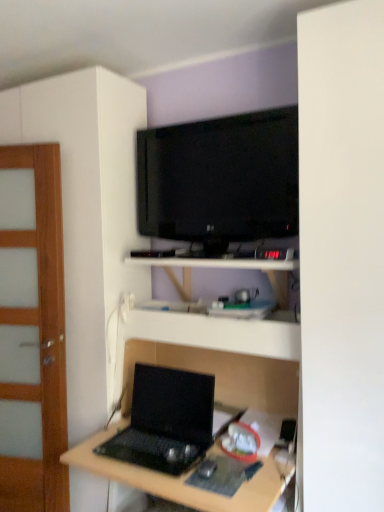
Question: Is matte black laptop at center not near wooden door at left?

Choices:
 (A) yes
 (B) no

Answer: (B)

Question: Does matte black laptop at center have a greater height compared to wooden door at left?

Choices:
 (A) no
 (B) yes

Answer: (A)

Question: Considering the relative sizes of matte black laptop at center and wooden door at left in the image provided, is matte black laptop at center bigger than wooden door at left?

Choices:
 (A) yes
 (B) no

Answer: (A)

Question: Is the position of matte black laptop at center less distant than that of wooden door at left?

Choices:
 (A) no
 (B) yes

Answer: (B)

Question: Does matte black laptop at center have a lesser height compared to wooden door at left?

Choices:
 (A) no
 (B) yes

Answer: (B)

Question: Is black plastic mouse at lower center bigger or smaller than matte black laptop at center?

Choices:
 (A) small
 (B) big

Answer: (A)

Question: From the image's perspective, relative to matte black laptop at center, is black plastic mouse at lower center above or below?

Choices:
 (A) below
 (B) above

Answer: (B)

Question: Does point (205, 474) appear closer or farther from the camera than point (274, 356)?

Choices:
 (A) closer
 (B) farther

Answer: (A)

Question: From a real-world perspective, is black plastic mouse at lower center above or below matte black laptop at center?

Choices:
 (A) above
 (B) below

Answer: (A)

Question: From the image's perspective, relative to white matte shelf at center, is wooden door at left above or below?

Choices:
 (A) below
 (B) above

Answer: (A)

Question: In terms of height, does wooden door at left look taller or shorter compared to white matte shelf at center?

Choices:
 (A) tall
 (B) short

Answer: (A)

Question: Is wooden door at left inside or outside of white matte shelf at center?

Choices:
 (A) inside
 (B) outside

Answer: (B)

Question: Is wooden door at left bigger or smaller than white matte shelf at center?

Choices:
 (A) big
 (B) small

Answer: (A)

Question: Is black matte laptop at lower center bigger or smaller than wooden door at left?

Choices:
 (A) big
 (B) small

Answer: (B)

Question: From a real-world perspective, is black matte laptop at lower center above or below wooden door at left?

Choices:
 (A) above
 (B) below

Answer: (B)